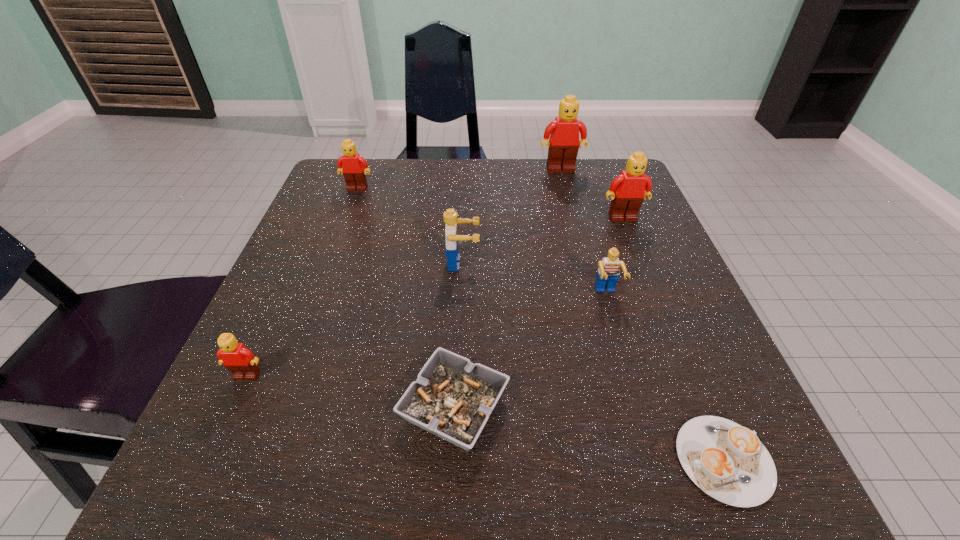
I want to click on vacant space in between the third smallest brown Lego and the white cappuccino, so click(673, 339).

Where is `empty space that is in between the tallest Lego and the nearer blue Lego`? Image resolution: width=960 pixels, height=540 pixels. empty space that is in between the tallest Lego and the nearer blue Lego is located at coordinates (584, 232).

In order to click on free area in between the cappuccino and the gray ashtray in this screenshot , I will do `click(589, 433)`.

At what (x,y) coordinates should I click in order to perform the action: click on free area in between the second farthest Lego and the nearest Lego. Please return your answer as a coordinate pair (x, y). Looking at the image, I should click on (302, 282).

Select which object appears as the fourth closest to the seventh nearest object. Please provide its 2D coordinates. Your answer should be formatted as a tuple, i.e. [(x, y)], where the tuple contains the x and y coordinates of a point satisfying the conditions above.

[(452, 398)]

At what (x,y) coordinates should I click in order to perform the action: click on object that is the fourth nearest to the shortest object. Please return your answer as a coordinate pair (x, y). Looking at the image, I should click on (628, 189).

Select which Lego is the closest to the nearest brown Lego. Please provide its 2D coordinates. Your answer should be formatted as a tuple, i.e. [(x, y)], where the tuple contains the x and y coordinates of a point satisfying the conditions above.

[(450, 217)]

The height and width of the screenshot is (540, 960). Find the location of `Lego object that ranks as the third closest to the smaller blue Lego`. Lego object that ranks as the third closest to the smaller blue Lego is located at coordinates (563, 145).

You are a GUI agent. You are given a task and a screenshot of the screen. Output one action in this format:
    pyautogui.click(x=<x>, y=<y>)
    Task: Click on the brown Lego that is the closest one to the biggest brown Lego
    Image resolution: width=960 pixels, height=540 pixels.
    Given the screenshot: What is the action you would take?
    pyautogui.click(x=628, y=189)

Select which brown Lego is the second closest to the second tallest Lego. Please provide its 2D coordinates. Your answer should be formatted as a tuple, i.e. [(x, y)], where the tuple contains the x and y coordinates of a point satisfying the conditions above.

[(353, 166)]